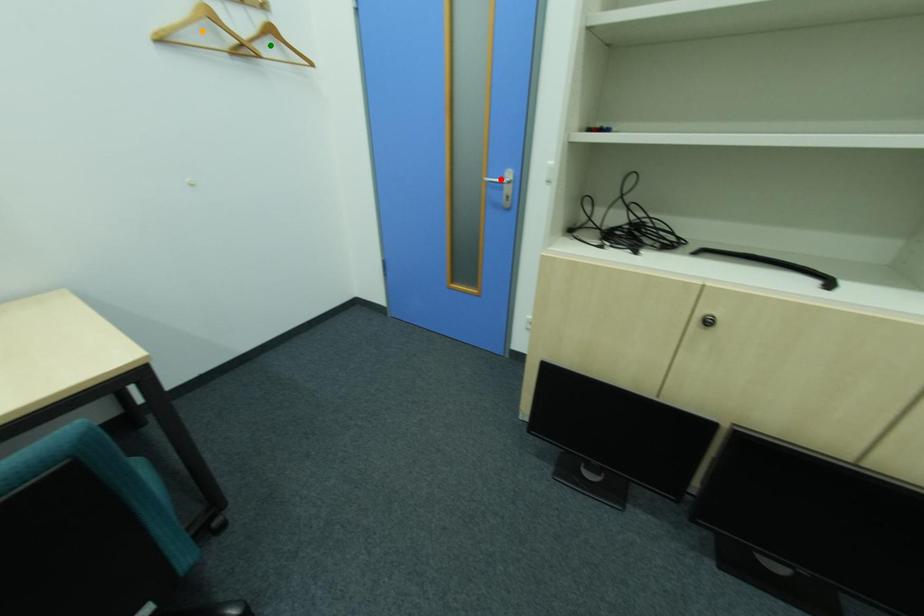
Order these from nearest to farthest:
1. red point
2. green point
3. orange point

orange point
green point
red point